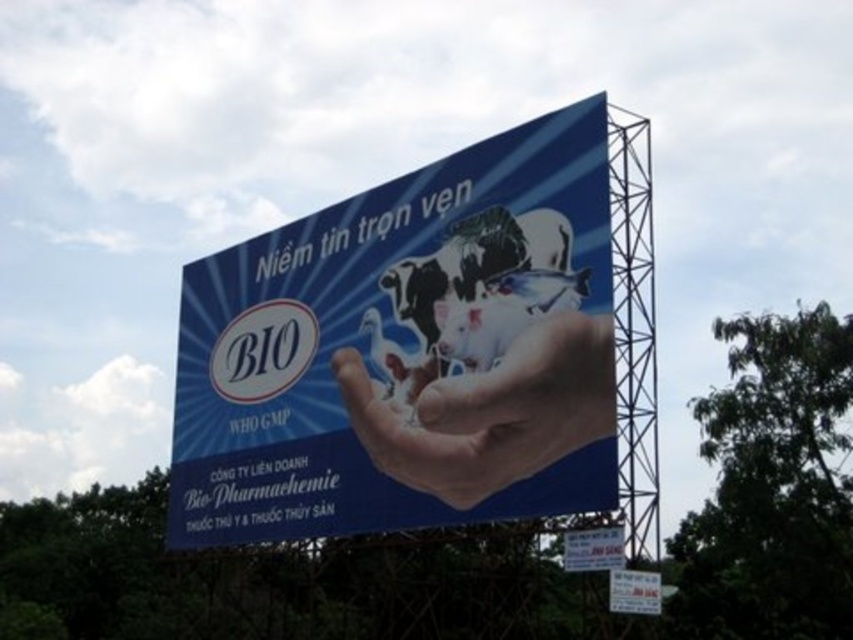
Question: Which object is closer to the camera taking this photo?

Choices:
 (A) smooth skin hand at center
 (B) blue matte billboard at center

Answer: (B)

Question: Does blue matte billboard at center have a lesser width compared to smooth skin hand at center?

Choices:
 (A) no
 (B) yes

Answer: (A)

Question: Does blue matte billboard at center have a smaller size compared to smooth skin hand at center?

Choices:
 (A) no
 (B) yes

Answer: (A)

Question: In this image, where is blue matte billboard at center located relative to smooth skin hand at center?

Choices:
 (A) right
 (B) left

Answer: (B)

Question: Which object appears farthest from the camera in this image?

Choices:
 (A) blue matte billboard at center
 (B) smooth skin hand at center

Answer: (B)